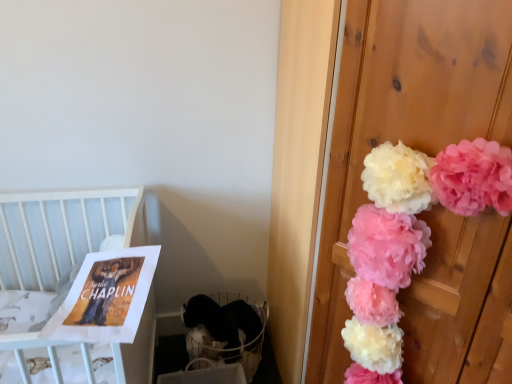
Question: Does point (23, 195) appear closer or farther from the camera than point (394, 292)?

Choices:
 (A) closer
 (B) farther

Answer: (B)

Question: From a real-world perspective, is white wood crib at upper left physically located above or below pink fluffy pom-poms at right?

Choices:
 (A) below
 (B) above

Answer: (A)

Question: Which object is the farthest from the white fabric baby carriage at lower left?

Choices:
 (A) matte paper poster at left
 (B) pink fluffy pom-poms at right
 (C) white wood crib at upper left

Answer: (B)

Question: Which object is the closest to the pink fluffy pom-poms at right?

Choices:
 (A) white fabric baby carriage at lower left
 (B) matte paper poster at left
 (C) white wood crib at upper left

Answer: (B)